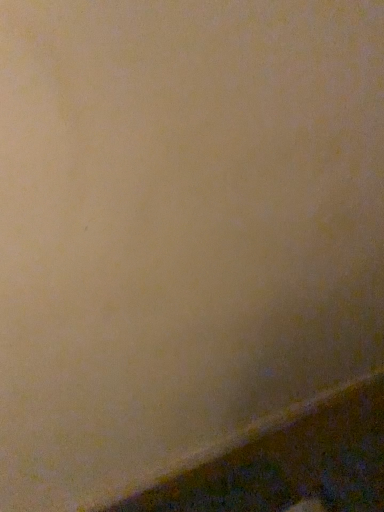
Describe the element at coordinates (286, 462) in the screenshot. The height and width of the screenshot is (512, 384). I see `matte brown bathtub at lower right` at that location.

You are a GUI agent. You are given a task and a screenshot of the screen. Output one action in this format:
    pyautogui.click(x=<x>, y=<y>)
    Task: Click on the matte brown bathtub at lower right
    
    Given the screenshot: What is the action you would take?
    pyautogui.click(x=286, y=462)

Measure the distance between matte brown bathtub at lower right and camera.

The depth of matte brown bathtub at lower right is 4.07 feet.

What are the coordinates of `matte brown bathtub at lower right` in the screenshot? It's located at (286, 462).